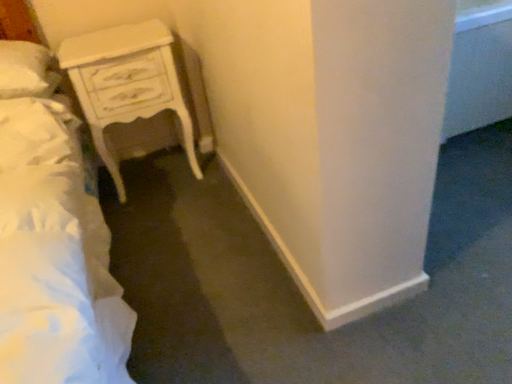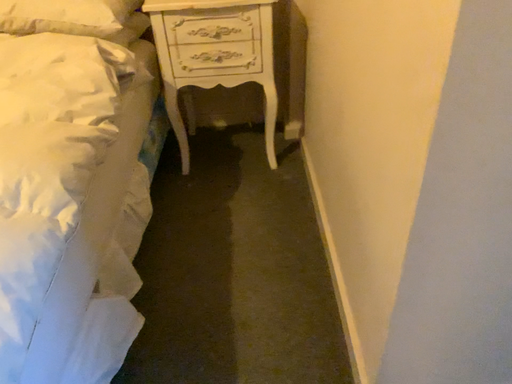
Question: How did the camera likely rotate when shooting the video?

Choices:
 (A) rotated right
 (B) rotated left

Answer: (B)